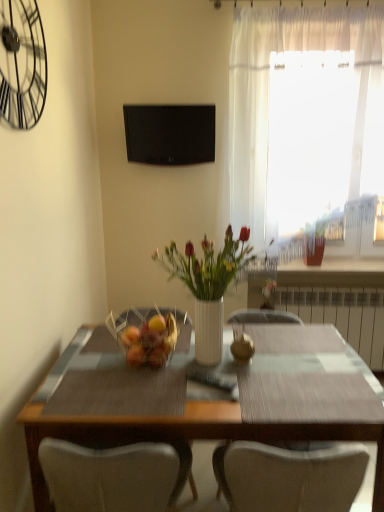
Question: Is white glossy vase at center positioned in front of black matte television at upper center?

Choices:
 (A) no
 (B) yes

Answer: (B)

Question: Considering the relative positions of white glossy vase at center and black matte television at upper center in the image provided, is white glossy vase at center behind black matte television at upper center?

Choices:
 (A) no
 (B) yes

Answer: (A)

Question: Can you see white glossy vase at center touching black matte television at upper center?

Choices:
 (A) yes
 (B) no

Answer: (B)

Question: Is white glossy vase at center wider than black matte television at upper center?

Choices:
 (A) no
 (B) yes

Answer: (B)

Question: Would you say white glossy vase at center is a long distance from black matte television at upper center?

Choices:
 (A) no
 (B) yes

Answer: (A)

Question: Is wooden table at center bigger or smaller than white metallic radiator at right?

Choices:
 (A) small
 (B) big

Answer: (B)

Question: In terms of width, does wooden table at center look wider or thinner when compared to white metallic radiator at right?

Choices:
 (A) wide
 (B) thin

Answer: (A)

Question: Is wooden table at center inside or outside of white metallic radiator at right?

Choices:
 (A) outside
 (B) inside

Answer: (A)

Question: Considering the positions of wooden table at center and white metallic radiator at right in the image, is wooden table at center taller or shorter than white metallic radiator at right?

Choices:
 (A) tall
 (B) short

Answer: (A)

Question: From a real-world perspective, relative to wooden table at center, is black matte television at upper center vertically above or below?

Choices:
 (A) below
 (B) above

Answer: (B)

Question: Is black matte television at upper center bigger or smaller than wooden table at center?

Choices:
 (A) small
 (B) big

Answer: (A)

Question: Considering the positions of point (155, 136) and point (84, 434), is point (155, 136) closer or farther from the camera than point (84, 434)?

Choices:
 (A) closer
 (B) farther

Answer: (B)

Question: From their relative heights in the image, would you say black matte television at upper center is taller or shorter than wooden table at center?

Choices:
 (A) tall
 (B) short

Answer: (B)

Question: Is point (145, 328) positioned closer to the camera than point (208, 263)?

Choices:
 (A) closer
 (B) farther

Answer: (B)

Question: Is translucent glass basket at center to the left or to the right of white glossy vase at center in the image?

Choices:
 (A) right
 (B) left

Answer: (B)